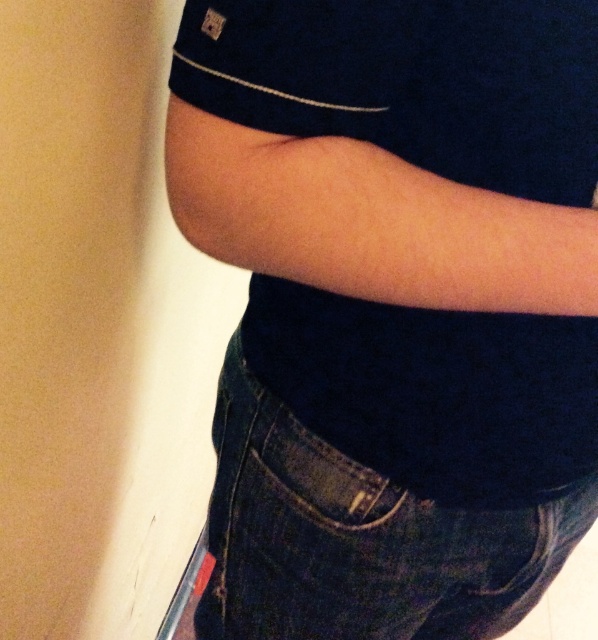
You are a tailor measuring a customer for a new outfit. You need to ensure that the distance between the dark blue cotton shirt at center and the dark blue denim jeans at lower center is at least 2 inches to allow for proper movement. Based on the image provided, is the current distance sufficient?

The distance between the dark blue cotton shirt at center and the dark blue denim jeans at lower center is 1.83 inches, which is less than the required 2 inches. Therefore, the current distance is not sufficient for proper movement.

You are a fashion designer trying to create a layered outfit. You have a dark blue cotton shirt at center and dark blue denim jeans at lower center in your design. Which piece of clothing would be visible on top in the final outfit?

The dark blue cotton shirt at center is in front of the dark blue denim jeans at lower center, so the shirt would be visible on top in the final outfit.

You are a fashion designer trying to create a new outfit. You have the dark blue cotton shirt at center and the dark blue denim jeans at lower center in front of you. Which piece of clothing is located more to the left side?

The dark blue cotton shirt at center is positioned on the left side of dark blue denim jeans at lower center, so it is more to the left side.